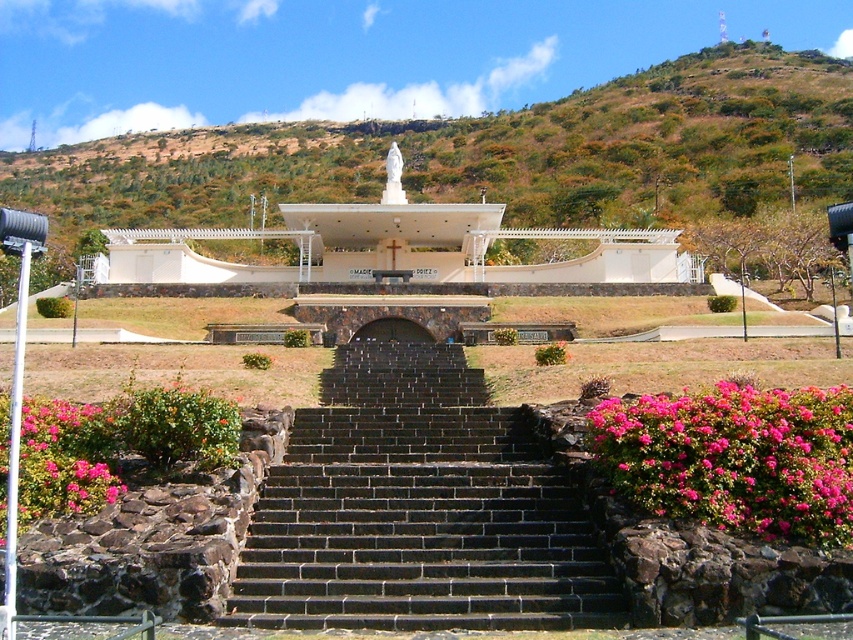
Question: Does green leafy hillside at upper center have a greater width compared to pink matte flowers at lower left?

Choices:
 (A) no
 (B) yes

Answer: (B)

Question: Which point is closer to the camera?

Choices:
 (A) (462, 490)
 (B) (70, 426)
 (C) (689, 156)

Answer: (B)

Question: Can you confirm if green leafy hillside at upper center is wider than pink matte flowers at lower left?

Choices:
 (A) yes
 (B) no

Answer: (A)

Question: Is green leafy hillside at upper center smaller than pink matte flowers at lower left?

Choices:
 (A) no
 (B) yes

Answer: (A)

Question: Which point is closer to the camera?

Choices:
 (A) black brick stairs at center
 (B) pink matte flowers at lower right

Answer: (A)

Question: Which is nearer to the pink matte flowers at lower left?

Choices:
 (A) black brick stairs at center
 (B) green leafy hillside at upper center
 (C) pink matte flowers at lower right

Answer: (A)